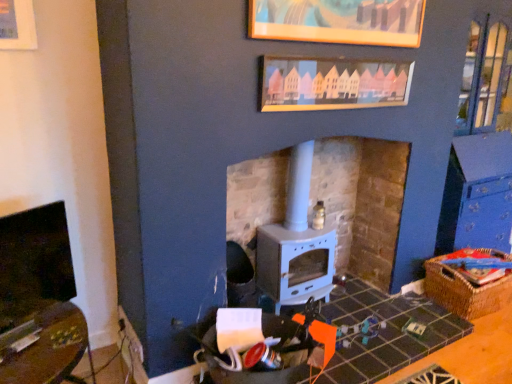
The width and height of the screenshot is (512, 384). Identify the location of free space above wooden picture frame at upper center, arranged as the 2th picture frame when viewed from the top (from a real-world perspective). (346, 49).